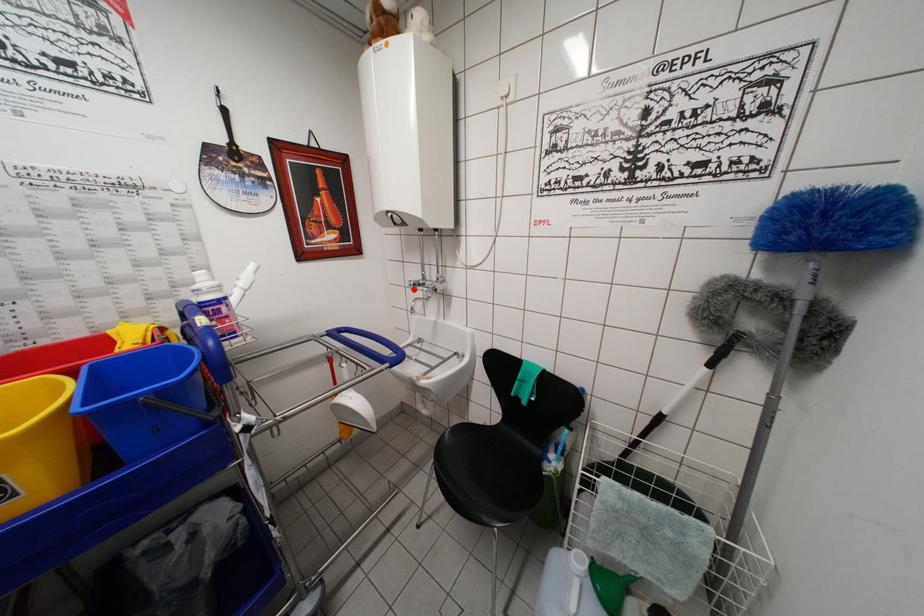
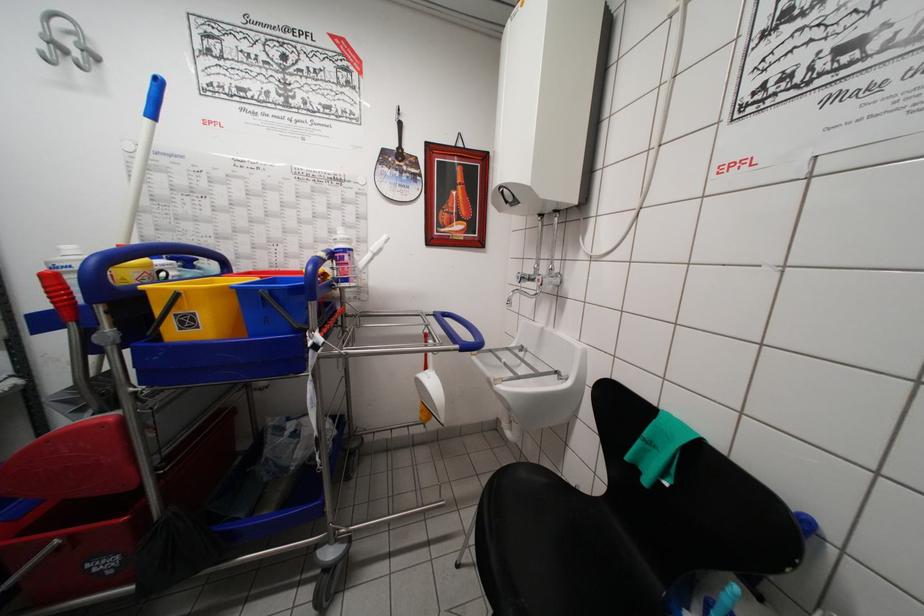
The point at the highlighted location is marked in the first image. Where is the corresponding point in the second image?

(521, 282)